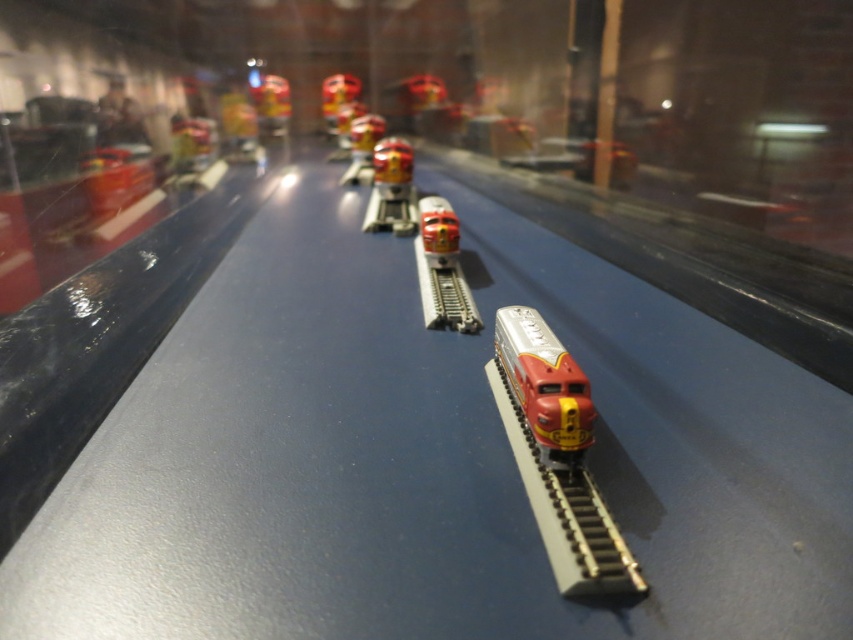
You are standing in front of the model train exhibit and want to determine which of the two points, point (285, 128) or point (444, 228), is closer to you. Which point is nearer?

Point (285, 128) is closer to you because it is further to the viewer than point (444, 228).

You are a visitor at the museum and want to take a photo of both the shiny silver train at center and the glossy plastic train at center. Which one will appear larger in your photo?

The shiny silver train at center will appear larger in the photo because it is closer to the viewer than the glossy plastic train at center.